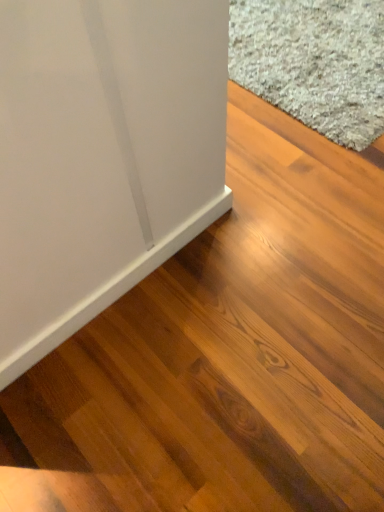
Question: Considering their positions, is white matte baseboard at lower left located in front of or behind gray shaggy carpet at upper right?

Choices:
 (A) behind
 (B) front

Answer: (B)

Question: In terms of width, does white matte baseboard at lower left look wider or thinner when compared to gray shaggy carpet at upper right?

Choices:
 (A) wide
 (B) thin

Answer: (B)

Question: Is white matte baseboard at lower left taller or shorter than gray shaggy carpet at upper right?

Choices:
 (A) short
 (B) tall

Answer: (B)

Question: Is gray shaggy carpet at upper right inside the boundaries of white matte baseboard at lower left, or outside?

Choices:
 (A) inside
 (B) outside

Answer: (B)

Question: Relative to white matte baseboard at lower left, is gray shaggy carpet at upper right in front or behind?

Choices:
 (A) front
 (B) behind

Answer: (B)

Question: Is gray shaggy carpet at upper right taller or shorter than white matte baseboard at lower left?

Choices:
 (A) tall
 (B) short

Answer: (B)

Question: Is point click(349, 90) positioned closer to the camera than point click(125, 57)?

Choices:
 (A) farther
 (B) closer

Answer: (A)